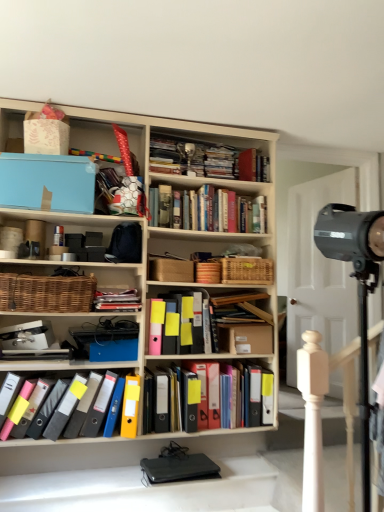
This screenshot has height=512, width=384. What do you see at coordinates (358, 290) in the screenshot?
I see `black metallic spotlight at right` at bounding box center [358, 290].

What do you see at coordinates (207, 210) in the screenshot? The image size is (384, 512). I see `hardcover books at center, marked as the fourth book in a bottom-to-top arrangement` at bounding box center [207, 210].

How much space does hardcover books at center, marked as the fourth book in a bottom-to-top arrangement, occupy vertically?

It is 11.75 inches.

The image size is (384, 512). In order to click on multicolored plastic binders at center, the fourth book from the top in this screenshot , I will do `click(271, 407)`.

The image size is (384, 512). What do you see at coordinates (271, 407) in the screenshot?
I see `multicolored plastic binders at center, marked as the first book in a bottom-to-top arrangement` at bounding box center [271, 407].

I want to click on woven brown basket at left, so click(57, 293).

Looking at this image, does woven brown basket at center come behind woven brown basket at left?

Yes, woven brown basket at center is behind woven brown basket at left.

Is woven brown basket at center looking in the opposite direction of woven brown basket at left?

woven brown basket at center does not have its back to woven brown basket at left.

Would you say woven brown basket at center is inside or outside woven brown basket at left?

woven brown basket at center is spatially situated outside woven brown basket at left.

Are woven brown basket at center and woven brown basket at left beside each other?

woven brown basket at center and woven brown basket at left are clearly separated.

From the picture: Is woven brown basket at left positioned with its back to matte black folders at center, the third book in the bottom-to-top sequence?

That's not correct — woven brown basket at left is not looking away from matte black folders at center, the third book in the bottom-to-top sequence.

From a real-world perspective, is woven brown basket at left located higher than matte black folders at center, the third book in the bottom-to-top sequence?

Yes, from a real-world perspective, woven brown basket at left is over matte black folders at center, the third book in the bottom-to-top sequence

Choose the correct answer: Is woven brown basket at left inside matte black folders at center, the 2th book in the top-to-bottom sequence, or outside it?

The correct answer is: outside.

Considering the relative sizes of woven brown basket at left and matte black folders at center, the third book in the bottom-to-top sequence, in the image provided, is woven brown basket at left taller than matte black folders at center, the third book in the bottom-to-top sequence,?

Yes, woven brown basket at left is taller than matte black folders at center, the third book in the bottom-to-top sequence.

From the image's perspective, is multicolored plastic binders at center, marked as the first book in a bottom-to-top arrangement, on top of hardcover books at center, the 1th book from the top?

No, from the image's perspective, multicolored plastic binders at center, marked as the first book in a bottom-to-top arrangement, is not above hardcover books at center, the 1th book from the top.

Between multicolored plastic binders at center, the fourth book from the top, and hardcover books at center, the 1th book from the top, which one has less height?

Standing shorter between the two is hardcover books at center, the 1th book from the top.

Is multicolored plastic binders at center, the fourth book from the top, wider or thinner than hardcover books at center, marked as the fourth book in a bottom-to-top arrangement?

multicolored plastic binders at center, the fourth book from the top, is thinner than hardcover books at center, marked as the fourth book in a bottom-to-top arrangement.

From a real-world perspective, is multicolored plastic binders at center, the fourth book from the top, below matte black folders at center, the third book in the bottom-to-top sequence?

Yes.

Could you tell me if multicolored plastic binders at center, the fourth book from the top, is facing matte black folders at center, the third book in the bottom-to-top sequence?

No, multicolored plastic binders at center, the fourth book from the top, is not facing towards matte black folders at center, the third book in the bottom-to-top sequence.

Which is more to the right, multicolored plastic binders at center, the fourth book from the top, or matte black folders at center, the 2th book in the top-to-bottom sequence?

From the viewer's perspective, multicolored plastic binders at center, the fourth book from the top, appears more on the right side.

Where is `television camera in front of the multicolored plastic binders at center, marked as the first book in a bottom-to-top arrangement`? television camera in front of the multicolored plastic binders at center, marked as the first book in a bottom-to-top arrangement is located at coordinates tap(358, 290).

Is multicolored plastic binders at center, marked as the first book in a bottom-to-top arrangement, positioned far away from black metallic spotlight at right?

Indeed, multicolored plastic binders at center, marked as the first book in a bottom-to-top arrangement, is not near black metallic spotlight at right.

How different are the orientations of multicolored plastic binders at center, the fourth book from the top, and black metallic spotlight at right in degrees?

The angle between the facing direction of multicolored plastic binders at center, the fourth book from the top, and the facing direction of black metallic spotlight at right is 168 degrees.

Is multicolored plastic binders at center, marked as the first book in a bottom-to-top arrangement, positioned with its back to black metallic spotlight at right?

No, multicolored plastic binders at center, marked as the first book in a bottom-to-top arrangement, is not facing away from black metallic spotlight at right.

Is hardcover books at center, marked as the fourth book in a bottom-to-top arrangement, located outside matte black folders at center, the third book in the bottom-to-top sequence?

Yes, hardcover books at center, marked as the fourth book in a bottom-to-top arrangement, is outside of matte black folders at center, the third book in the bottom-to-top sequence.

Could you tell me if hardcover books at center, marked as the fourth book in a bottom-to-top arrangement, is facing matte black folders at center, the 2th book in the top-to-bottom sequence?

No, hardcover books at center, marked as the fourth book in a bottom-to-top arrangement, does not turn towards matte black folders at center, the 2th book in the top-to-bottom sequence.

In terms of height, does hardcover books at center, marked as the fourth book in a bottom-to-top arrangement, look taller or shorter compared to matte black folders at center, the 2th book in the top-to-bottom sequence?

Considering their sizes, hardcover books at center, marked as the fourth book in a bottom-to-top arrangement, has more height than matte black folders at center, the 2th book in the top-to-bottom sequence.

From the image's perspective, which object appears higher, hardcover books at center, marked as the fourth book in a bottom-to-top arrangement, or matte black folders at center, the third book in the bottom-to-top sequence?

hardcover books at center, marked as the fourth book in a bottom-to-top arrangement, appears higher in the image.

Is matte black folders at center, the 2th book in the top-to-bottom sequence, not close to woven brown basket at center?

No, matte black folders at center, the 2th book in the top-to-bottom sequence, is in close proximity to woven brown basket at center.

From the picture: In terms of width, does matte black folders at center, the third book in the bottom-to-top sequence, look wider or thinner when compared to woven brown basket at center?

Considering their sizes, matte black folders at center, the third book in the bottom-to-top sequence, looks slimmer than woven brown basket at center.

The width and height of the screenshot is (384, 512). What are the coordinates of `shelf below the woven brown basket at center (from the image's perspective)` in the screenshot? It's located at (57, 293).

Where is `shelf above the matte black folders at center, the third book in the bottom-to-top sequence (from the image's perspective)`? The width and height of the screenshot is (384, 512). shelf above the matte black folders at center, the third book in the bottom-to-top sequence (from the image's perspective) is located at coordinates (57, 293).

From the image, which object appears to be farther from black metallic spotlight at right, black plastic wallet at lower center or woven brown basket at left?

→ Based on the image, woven brown basket at left appears to be further to black metallic spotlight at right.

Based on their spatial positions, is multicolored plastic binders at center, the fourth book from the top, or woven brown basket at center closer to woven brown basket at left?

Based on the image, multicolored plastic binders at center, the fourth book from the top, appears to be nearer to woven brown basket at left.

From the image, which object appears to be farther from multicolored plastic binders at center, the fourth book from the top, matte black folders at center, the 2th book in the top-to-bottom sequence, or black plastic wallet at lower center?

The object further to multicolored plastic binders at center, the fourth book from the top, is matte black folders at center, the 2th book in the top-to-bottom sequence.

Which object lies further to the anchor point black metallic spotlight at right, black plastic wallet at lower center or matte black folders at center, the third book in the bottom-to-top sequence?

The object further to black metallic spotlight at right is matte black folders at center, the third book in the bottom-to-top sequence.

Estimate the real-world distances between objects in this image. Which object is further from multicolored plastic binders at center, marked as the first book in a bottom-to-top arrangement, woven brown basket at center or matte plastic folders at lower left, acting as the second book starting from the bottom?

woven brown basket at center is further to multicolored plastic binders at center, marked as the first book in a bottom-to-top arrangement.

From the picture: Which object lies nearer to the anchor point black metallic spotlight at right, woven brown basket at center or black plastic wallet at lower center?

woven brown basket at center.

Considering their positions, is black plastic wallet at lower center positioned further to woven brown basket at center than hardcover books at center, the 1th book from the top?

The object further to woven brown basket at center is black plastic wallet at lower center.

From the image, which object appears to be farther from woven brown basket at center, black plastic wallet at lower center or multicolored plastic binders at center, the fourth book from the top?

black plastic wallet at lower center.

What are the coordinates of `basket between black metallic spotlight at right and hardcover books at center, the 1th book from the top, from front to back` in the screenshot? It's located at (247, 270).

The height and width of the screenshot is (512, 384). Find the location of `stairwell between matte plastic folders at lower left, the 3th book positioned from the top, and multicolored plastic binders at center, marked as the first book in a bottom-to-top arrangement, in the horizontal direction`. stairwell between matte plastic folders at lower left, the 3th book positioned from the top, and multicolored plastic binders at center, marked as the first book in a bottom-to-top arrangement, in the horizontal direction is located at coordinates (143, 490).

At what (x,y) coordinates should I click in order to perform the action: click on shelf between hardcover books at center, the 1th book from the top, and black plastic wallet at lower center, in the vertical direction. Please return your answer as a coordinate pair (x, y). This screenshot has height=512, width=384. Looking at the image, I should click on (57, 293).

You are a GUI agent. You are given a task and a screenshot of the screen. Output one action in this format:
    pyautogui.click(x=<x>, y=<y>)
    Task: Click on the basket between hardcover books at center, the 1th book from the top, and black plastic wallet at lower center, in the vertical direction
    
    Given the screenshot: What is the action you would take?
    pyautogui.click(x=247, y=270)